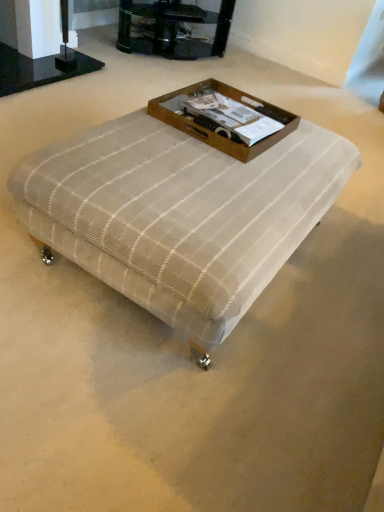
Find the location of a particular element. free space above brown wooden tray at center (from a real-world perspective) is located at coordinates (228, 106).